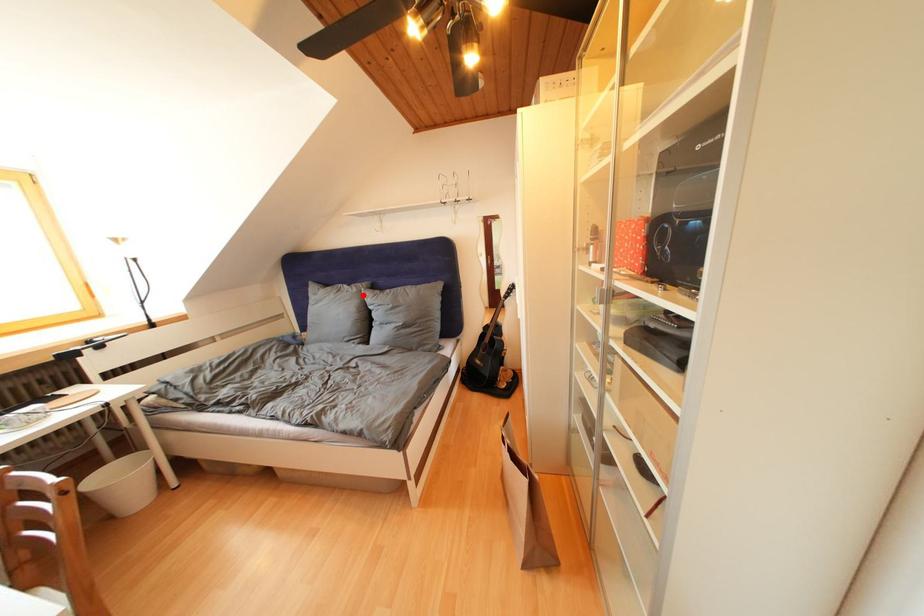
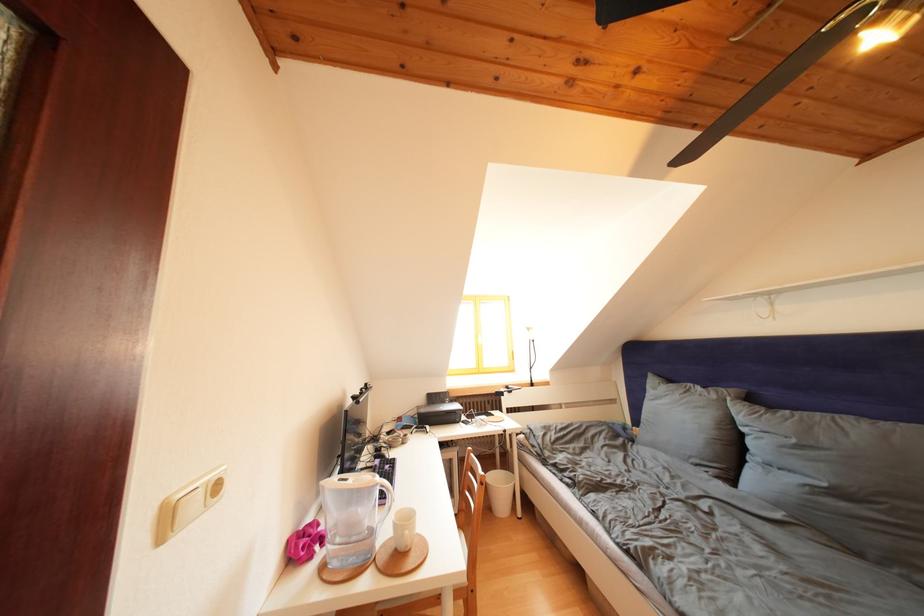
Where in the second image is the point corresponding to the highlighted location from the first image?

(722, 402)